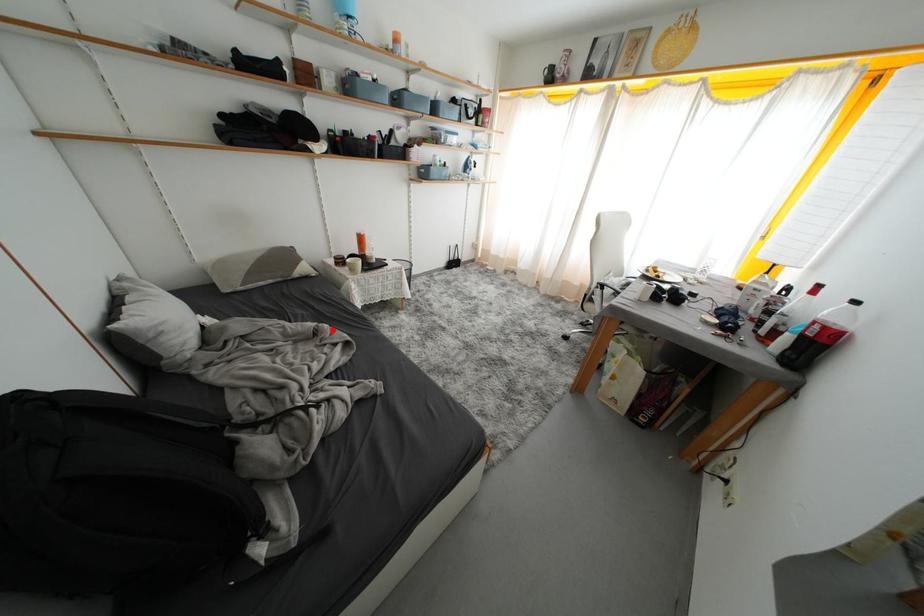
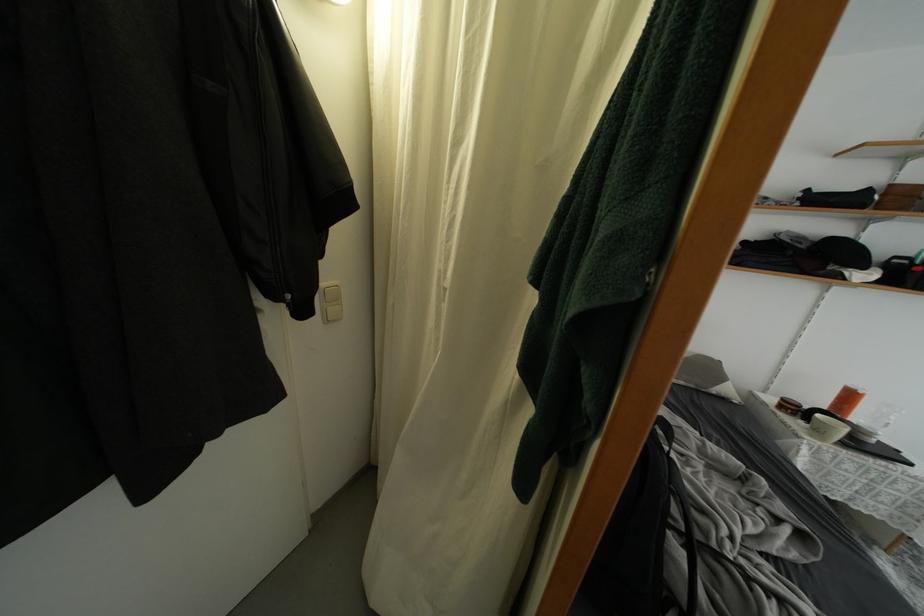
Where in the second image is the point corresponding to the highlighted location from the first image?

(769, 485)